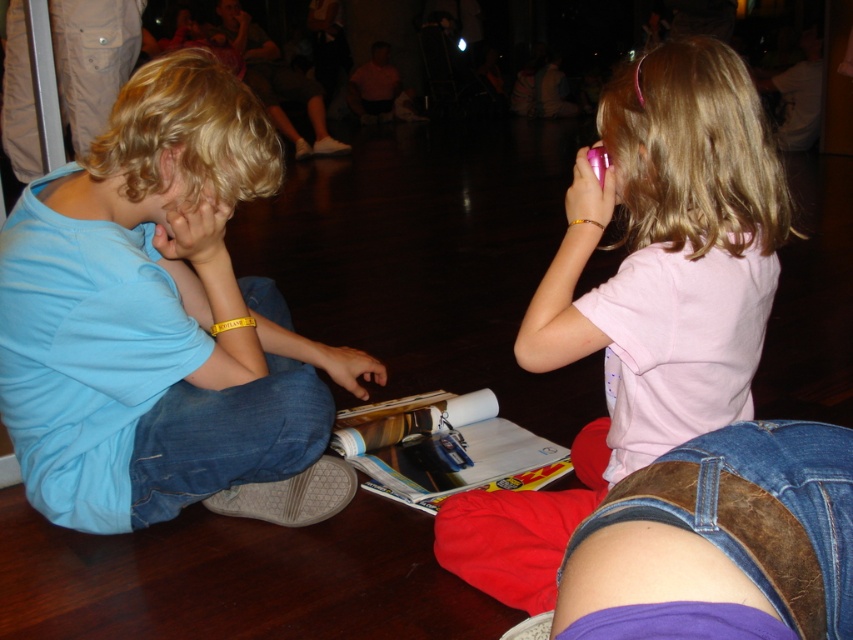
You are a parent trying to hand a toy to the child in the matte blue shirt at left. The toy is placed on the floor between you and the child. Can you reach the child without moving the toy?

The distance between you and the child in the matte blue shirt at left is 1.28 meters. Since the toy is on the floor between you, you can reach the child by bending down to pick up the toy and hand it to them without needing to move it further.

You are a child looking at the pink matte phone at upper right and the brown leather belt at lower right. Which object is closer to you?

The pink matte phone at upper right is closer to you because it is further to the viewer than the brown leather belt at lower right.